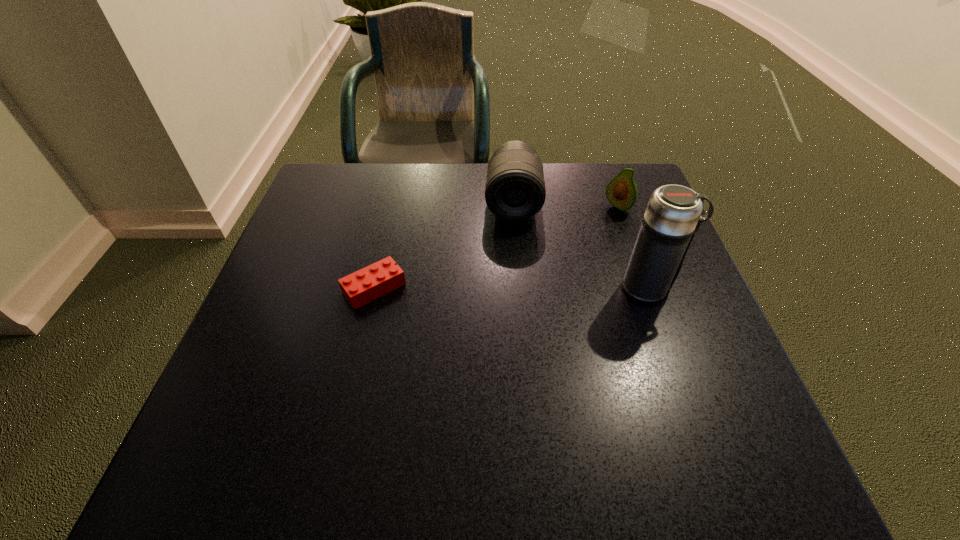
This screenshot has width=960, height=540. Identify the location of free space at the left edge of the desktop. (331, 232).

What are the coordinates of `free spot at the far left corner of the desktop` in the screenshot? It's located at (321, 176).

Locate an element on the screen. vacant area at the far right corner of the desktop is located at coordinates point(610,212).

You are a GUI agent. You are given a task and a screenshot of the screen. Output one action in this format:
    pyautogui.click(x=<x>, y=<y>)
    Task: Click on the vacant space at the near right corner of the desktop
    The height and width of the screenshot is (540, 960).
    Given the screenshot: What is the action you would take?
    pyautogui.click(x=709, y=377)

This screenshot has height=540, width=960. I want to click on empty space between the leftmost object and the second object from left to right, so click(444, 245).

At what (x,y) coordinates should I click in order to perform the action: click on free point between the shortest object and the tallest object. Please return your answer as a coordinate pair (x, y). This screenshot has width=960, height=540. Looking at the image, I should click on (512, 288).

I want to click on free space between the third tallest object and the Lego, so click(x=496, y=248).

Locate an element on the screen. vacant area between the thermos bottle and the second shortest object is located at coordinates (634, 248).

Locate an element on the screen. The width and height of the screenshot is (960, 540). vacant area that lies between the avocado and the tallest object is located at coordinates (634, 248).

Find the location of a particular element. This screenshot has width=960, height=540. unoccupied area between the Lego and the second shortest object is located at coordinates (496, 248).